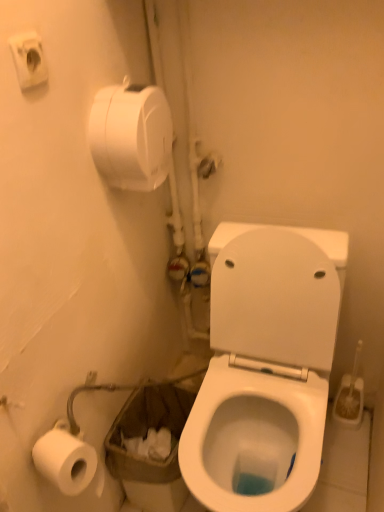
Find the location of `white plastic toilet brush at right`. white plastic toilet brush at right is located at coordinates (350, 395).

In order to face white matte toilet paper at upper left, should I rotate leftwards or rightwards?

You should rotate left by 6.732 degrees.

Measure the distance between point (x=129, y=87) and camera.

Point (x=129, y=87) and camera are 3.41 feet apart.

Locate an element on the screen. white glossy toilet at center is located at coordinates (264, 368).

Does point (336, 411) lie in front of point (272, 456)?

No, it is not.

Can you confirm if white plastic toilet brush at right is taller than white glossy toilet at center?

Incorrect, the height of white plastic toilet brush at right is not larger of that of white glossy toilet at center.

In the scene shown: Considering the relative sizes of white plastic toilet brush at right and white glossy toilet at center in the image provided, is white plastic toilet brush at right wider than white glossy toilet at center?

No.

Is white plastic toilet brush at right completely or partially outside of white glossy toilet at center?

That's correct, white plastic toilet brush at right is outside of white glossy toilet at center.

Is there a large distance between white glossy toilet at center and white plastic toilet brush at right?

white glossy toilet at center is near white plastic toilet brush at right, not far away.

Is point (257, 450) less distant than point (343, 389)?

Yes, it is in front of point (343, 389).

From the image's perspective, is white glossy toilet at center below white plastic toilet brush at right?

Incorrect, from the image's perspective, white glossy toilet at center is higher than white plastic toilet brush at right.

Is point (128, 166) farther from camera compared to point (263, 252)?

No, (128, 166) is closer to viewer.

From a real-world perspective, between white matte toilet paper at upper left and white glossy toilet at center, who is vertically higher?

In real-world perspective, white matte toilet paper at upper left is above.

Does white matte toilet paper at upper left have a lesser height compared to white plastic toilet brush at right?

Yes.

Which of these two, white matte toilet paper at upper left or white plastic toilet brush at right, is wider?

Wider between the two is white matte toilet paper at upper left.

Is white matte toilet paper at upper left not within white plastic toilet brush at right?

Yes.

Between point (102, 122) and point (353, 375), which one is positioned in front?

The point (102, 122) is more forward.

From a real-world perspective, is white glossy toilet at center on white matte toilet paper at upper left?

No, from a real-world perspective, white glossy toilet at center is not above white matte toilet paper at upper left.

Considering the relative positions of white glossy toilet at center and white matte toilet paper at upper left in the image provided, is white glossy toilet at center behind white matte toilet paper at upper left?

No.

Does white plastic toilet brush at right appear on the left side of white matte toilet paper at upper left?

In fact, white plastic toilet brush at right is to the right of white matte toilet paper at upper left.

Is white plastic toilet brush at right facing away from white matte toilet paper at upper left?

No, white plastic toilet brush at right is not facing the opposite direction of white matte toilet paper at upper left.

From the image's perspective, is white plastic toilet brush at right over white matte toilet paper at upper left?

Incorrect, from the image's perspective, white plastic toilet brush at right is lower than white matte toilet paper at upper left.

The width and height of the screenshot is (384, 512). Find the location of `toilet located on the left of white plastic toilet brush at right`. toilet located on the left of white plastic toilet brush at right is located at coordinates (264, 368).

At what (x,y) coordinates should I click in order to perform the action: click on toilet lying in front of the white plastic toilet brush at right. Please return your answer as a coordinate pair (x, y). Looking at the image, I should click on (264, 368).

Based on their spatial positions, is white matte toilet paper at upper left or white plastic toilet brush at right closer to white glossy toilet at center?

white plastic toilet brush at right is positioned closer to the anchor white glossy toilet at center.

Estimate the real-world distances between objects in this image. Which object is closer to white plastic toilet brush at right, white glossy toilet at center or white matte toilet paper at upper left?

Among the two, white glossy toilet at center is located nearer to white plastic toilet brush at right.

From the image, which object appears to be farther from white glossy toilet at center, white plastic toilet brush at right or white matte toilet paper at upper left?

white matte toilet paper at upper left lies further to white glossy toilet at center than the other object.

Looking at the image, which one is located closer to white matte toilet paper at upper left, white plastic toilet brush at right or white glossy toilet at center?

Based on the image, white glossy toilet at center appears to be nearer to white matte toilet paper at upper left.

Considering their positions, is white matte toilet paper at upper left positioned closer to white plastic toilet brush at right than white glossy toilet at center?

Among the two, white glossy toilet at center is located nearer to white plastic toilet brush at right.

Which object lies further to the anchor point white matte toilet paper at upper left, white glossy toilet at center or white plastic toilet brush at right?

white plastic toilet brush at right is further to white matte toilet paper at upper left.

Image resolution: width=384 pixels, height=512 pixels. I want to click on toilet between white matte toilet paper at upper left and white plastic toilet brush at right vertically, so click(264, 368).